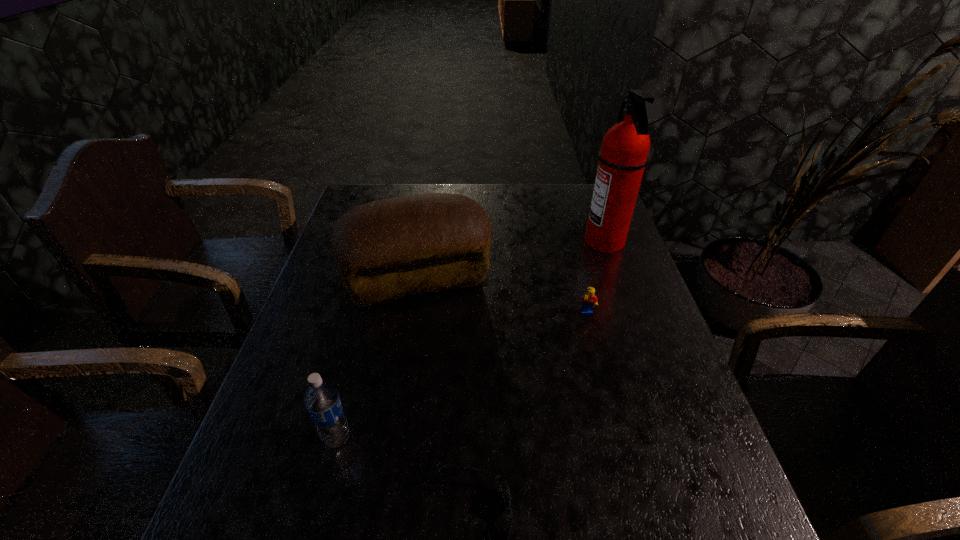
Find the location of a particular element. This screenshot has height=540, width=960. the tallest object is located at coordinates (624, 154).

I want to click on the rightmost object, so click(x=624, y=154).

At what (x,y) coordinates should I click in order to perform the action: click on the second tallest object. Please return your answer as a coordinate pair (x, y). Looking at the image, I should click on (387, 249).

Where is `the second nearest object`? the second nearest object is located at coordinates (322, 401).

What are the coordinates of `the third tallest object` in the screenshot? It's located at (322, 401).

This screenshot has height=540, width=960. What are the coordinates of `the fourth tallest object` in the screenshot? It's located at (589, 300).

Locate an element on the screen. The width and height of the screenshot is (960, 540). the fourth object from left to right is located at coordinates (589, 300).

Where is `vacant space located on the side of the tallest object near the handle`? vacant space located on the side of the tallest object near the handle is located at coordinates (476, 241).

The image size is (960, 540). I want to click on free space located 0.280m on the side of the tallest object near the handle, so click(494, 241).

The image size is (960, 540). Identify the location of vacant area located on the side of the tallest object near the handle. (482, 241).